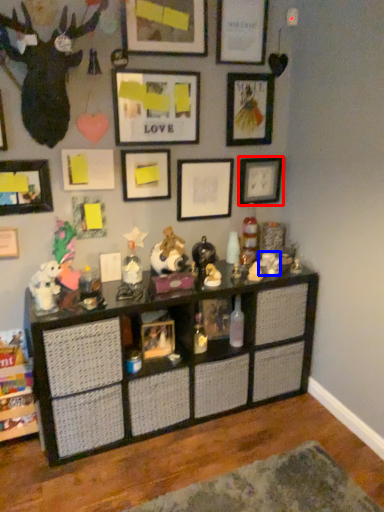
Question: Which object is further to the camera taking this photo, picture frame (highlighted by a red box) or toy (highlighted by a blue box)?

Choices:
 (A) picture frame
 (B) toy

Answer: (B)